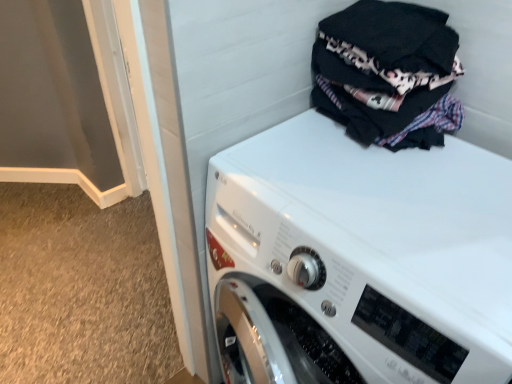
Question: Can you confirm if black cotton laundry at upper right is thinner than white glossy washing machine at upper right?

Choices:
 (A) yes
 (B) no

Answer: (A)

Question: Is black cotton laundry at upper right further to the viewer compared to white glossy washing machine at upper right?

Choices:
 (A) yes
 (B) no

Answer: (A)

Question: Is black cotton laundry at upper right shorter than white glossy washing machine at upper right?

Choices:
 (A) no
 (B) yes

Answer: (B)

Question: Can you confirm if black cotton laundry at upper right is wider than white glossy washing machine at upper right?

Choices:
 (A) yes
 (B) no

Answer: (B)

Question: Considering the relative sizes of black cotton laundry at upper right and white glossy washing machine at upper right in the image provided, is black cotton laundry at upper right bigger than white glossy washing machine at upper right?

Choices:
 (A) yes
 (B) no

Answer: (B)

Question: Would you consider black cotton laundry at upper right to be distant from white glossy washing machine at upper right?

Choices:
 (A) no
 (B) yes

Answer: (A)

Question: Is white glossy washing machine at upper right further to camera compared to black cotton laundry at upper right?

Choices:
 (A) no
 (B) yes

Answer: (A)

Question: Considering the relative positions of white glossy washing machine at upper right and black cotton laundry at upper right in the image provided, is white glossy washing machine at upper right to the right of black cotton laundry at upper right from the viewer's perspective?

Choices:
 (A) yes
 (B) no

Answer: (B)

Question: Is white glossy washing machine at upper right with black cotton laundry at upper right?

Choices:
 (A) yes
 (B) no

Answer: (B)

Question: Is white glossy washing machine at upper right at the left side of black cotton laundry at upper right?

Choices:
 (A) yes
 (B) no

Answer: (A)

Question: From a real-world perspective, is white glossy washing machine at upper right on top of black cotton laundry at upper right?

Choices:
 (A) yes
 (B) no

Answer: (B)

Question: Is black cotton laundry at upper right surrounded by white glossy washing machine at upper right?

Choices:
 (A) yes
 (B) no

Answer: (B)

Question: Considering the positions of white glossy washing machine at upper right and black cotton laundry at upper right in the image, is white glossy washing machine at upper right bigger or smaller than black cotton laundry at upper right?

Choices:
 (A) big
 (B) small

Answer: (A)